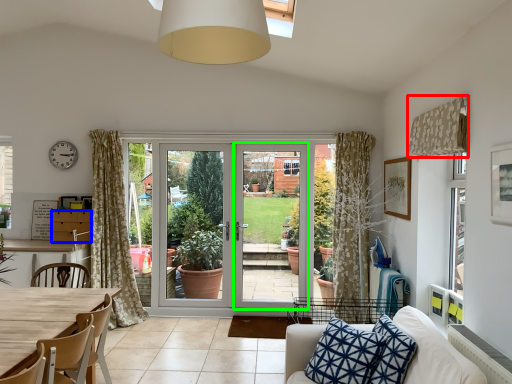
Question: Based on their relative distances, which object is nearer to curtain (highlighted by a red box)? Choose from cabinetry (highlighted by a blue box) and screen door (highlighted by a green box).

Choices:
 (A) cabinetry
 (B) screen door

Answer: (B)